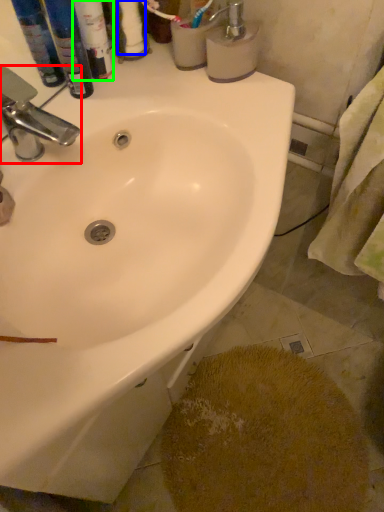
Question: Which object is the farthest from tap (highlighted by a red box)? Choose among these: toilet paper (highlighted by a blue box) or toiletry (highlighted by a green box).

Choices:
 (A) toilet paper
 (B) toiletry

Answer: (A)